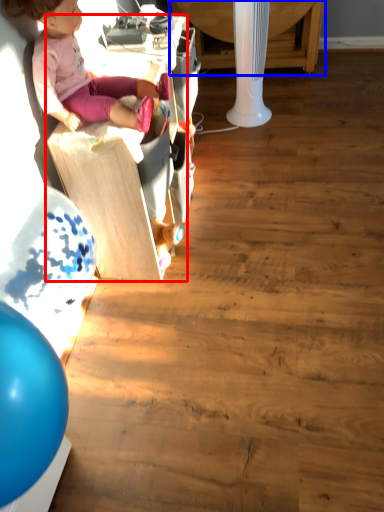
Question: Which of the following is the farthest to the observer, furniture (highlighted by a red box) or table (highlighted by a blue box)?

Choices:
 (A) furniture
 (B) table

Answer: (B)